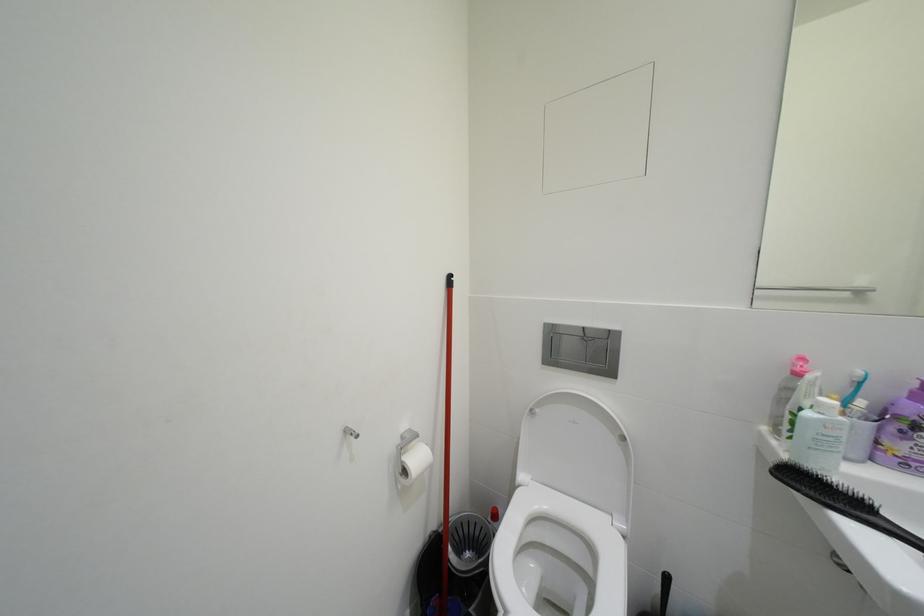
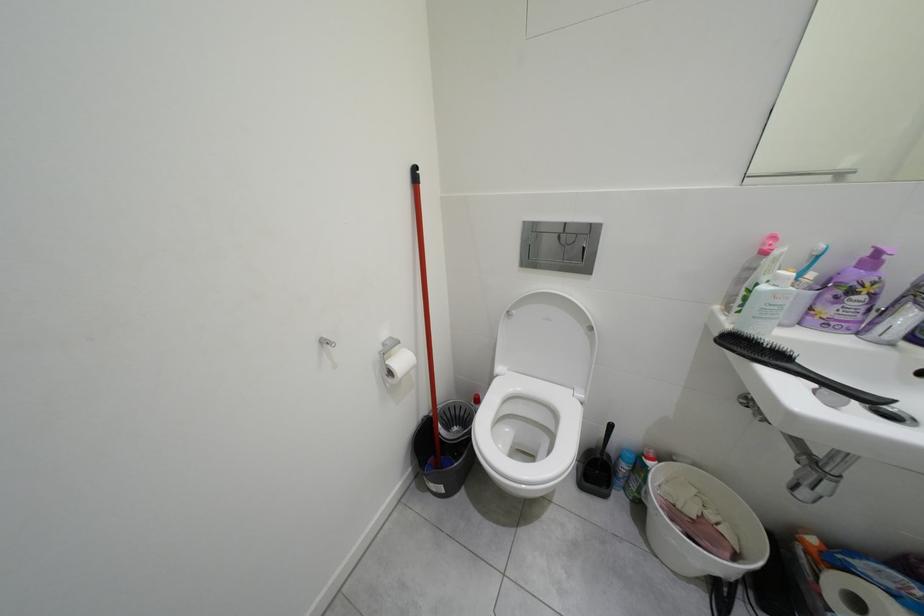
Question: How did the camera likely rotate?

Choices:
 (A) Left
 (B) Right
 (C) Up
 (D) Down

Answer: (D)